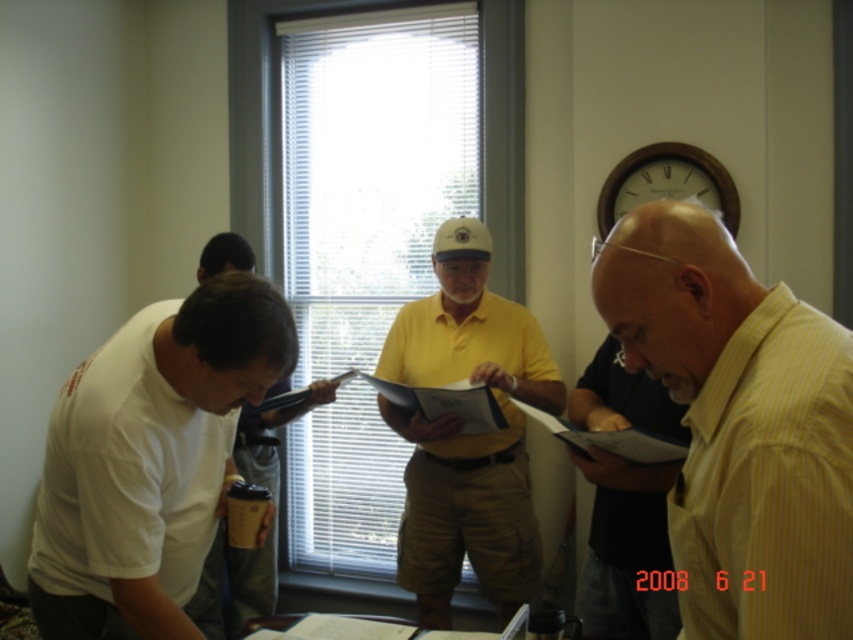
Question: Can you confirm if wooden clock at upper center is positioned above white matte baseball hat at center?

Choices:
 (A) yes
 (B) no

Answer: (A)

Question: Considering the real-world distances, which object is farthest from the light brown striped shirt at right?

Choices:
 (A) white matte shirt at lower left
 (B) white matte baseball hat at center
 (C) yellow striped shirt at right

Answer: (A)

Question: Is yellow cotton shirt at center to the right of wooden clock at upper center from the viewer's perspective?

Choices:
 (A) yes
 (B) no

Answer: (B)

Question: Which object is positioned farthest from the white matte t-shirt at left?

Choices:
 (A) yellow cotton shirt at center
 (B) white matte baseball hat at center
 (C) yellow striped shirt at right

Answer: (B)

Question: Which of these objects is positioned farthest from the white matte t-shirt at left?

Choices:
 (A) wooden clock at upper center
 (B) white matte baseball hat at center

Answer: (A)

Question: Does yellow striped shirt at right appear over white matte shirt at lower left?

Choices:
 (A) no
 (B) yes

Answer: (B)